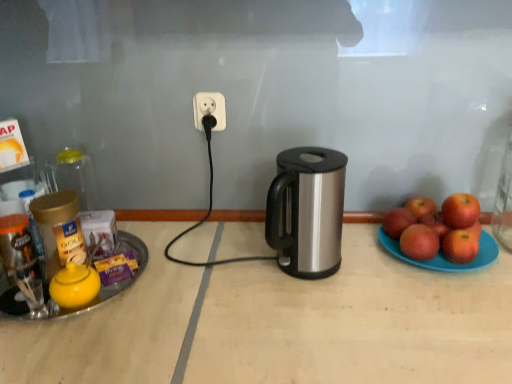
Where is `space that is in front of blue plastic plate at right`? The height and width of the screenshot is (384, 512). space that is in front of blue plastic plate at right is located at coordinates (449, 312).